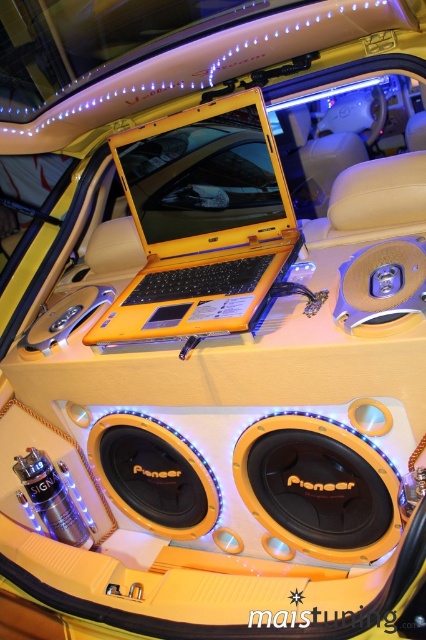
Question: Which of the following is the closest to the observer?

Choices:
 (A) (360, 428)
 (B) (348, 284)

Answer: (A)

Question: Where is yellow matte laptop at center located in relation to metallic gold speaker at center in the image?

Choices:
 (A) above
 (B) below

Answer: (A)

Question: Which of the following is the farthest from the observer?

Choices:
 (A) yellow matte laptop at center
 (B) yellow matte pioneer speaker at center
 (C) metallic gold speaker at center

Answer: (A)

Question: Does yellow matte pioneer speaker at center have a larger size compared to metallic gold speaker at center?

Choices:
 (A) yes
 (B) no

Answer: (A)

Question: Does yellow matte laptop at center have a greater width compared to metallic gold speaker at center?

Choices:
 (A) no
 (B) yes

Answer: (B)

Question: Among these objects, which one is farthest from the camera?

Choices:
 (A) yellow matte pioneer speaker at center
 (B) metallic gold speaker at center

Answer: (A)